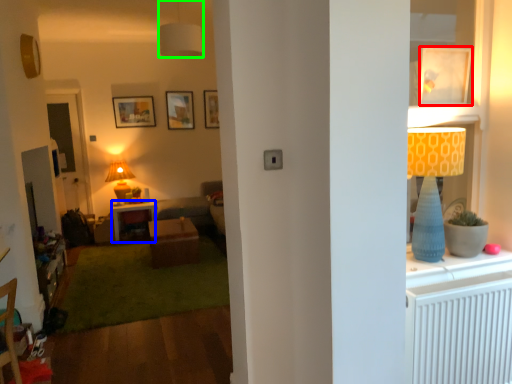
Question: Considering the real-world distances, which object is closest to picture frame (highlighted by a red box)? desk (highlighted by a blue box) or lamp (highlighted by a green box).

Choices:
 (A) desk
 (B) lamp

Answer: (B)